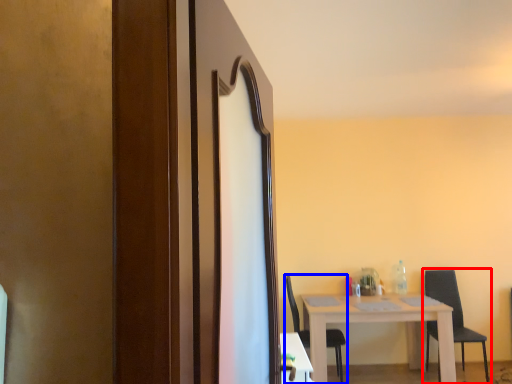
Question: Which object appears closest to the camera in this image, chair (highlighted by a red box) or chair (highlighted by a blue box)?

Choices:
 (A) chair
 (B) chair

Answer: (B)